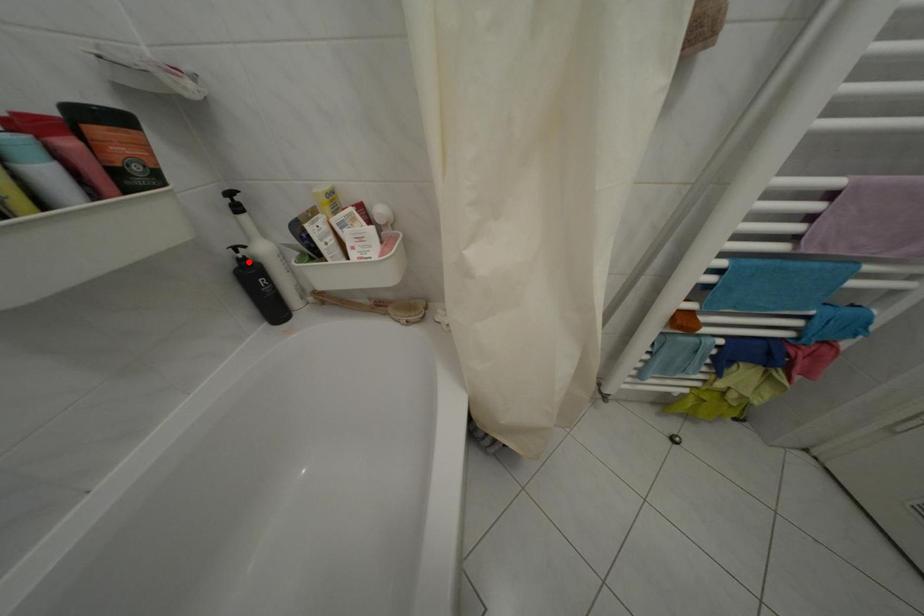
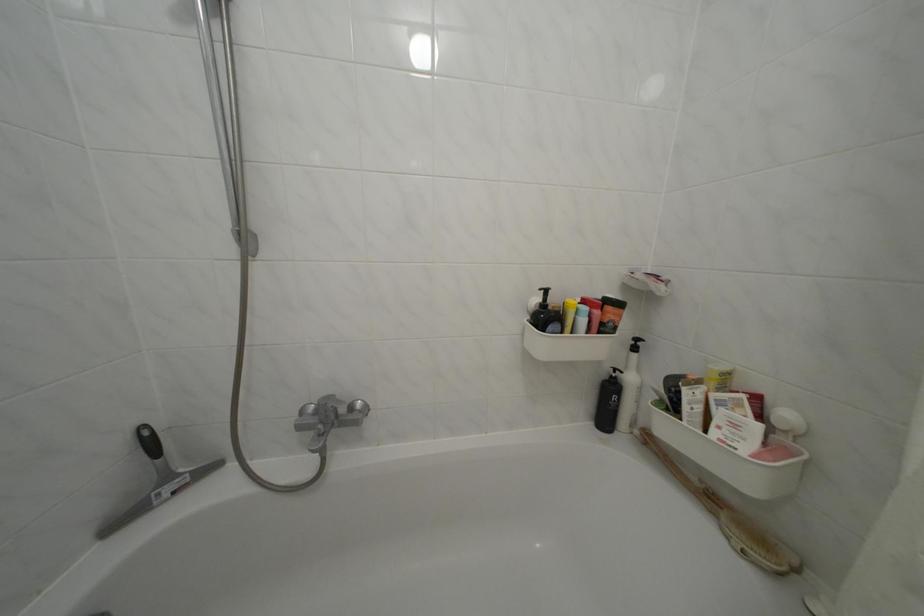
In the second image, find the point that corresponds to the highlighted location in the first image.

(623, 381)